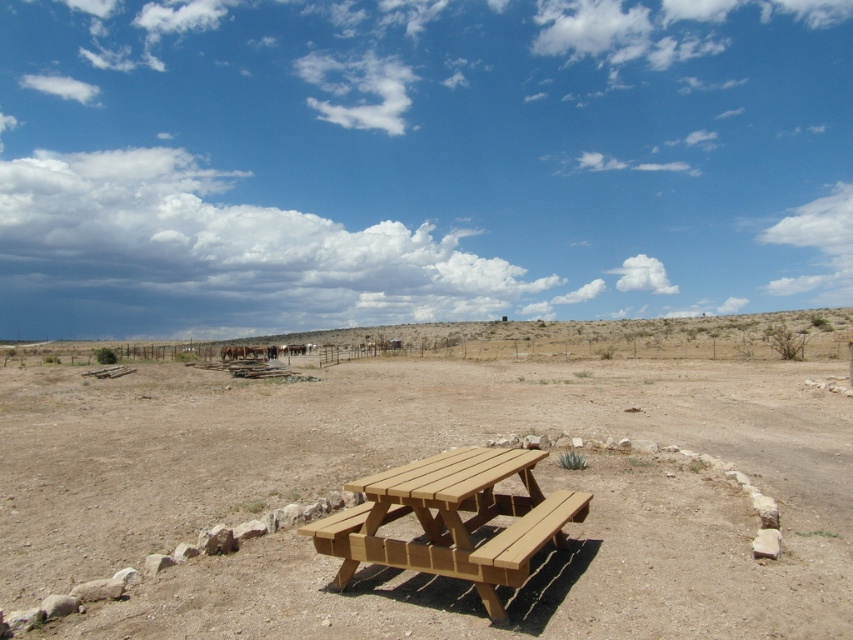
Does brown wood picnic table at center appear over wooden picnic table at center?

No.

Is brown wood picnic table at center wider than wooden picnic table at center?

Indeed, brown wood picnic table at center has a greater width compared to wooden picnic table at center.

Does point (656, 634) lie in front of point (479, 548)?

Yes, point (656, 634) is in front of point (479, 548).

The height and width of the screenshot is (640, 853). What are the coordinates of `brown wood picnic table at center` in the screenshot? It's located at (415, 458).